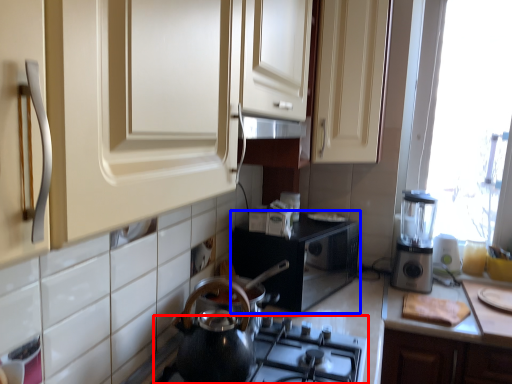
Question: Which point is closer to the camera, gas stove (highlighted by a red box) or appliance (highlighted by a blue box)?

Choices:
 (A) gas stove
 (B) appliance

Answer: (A)